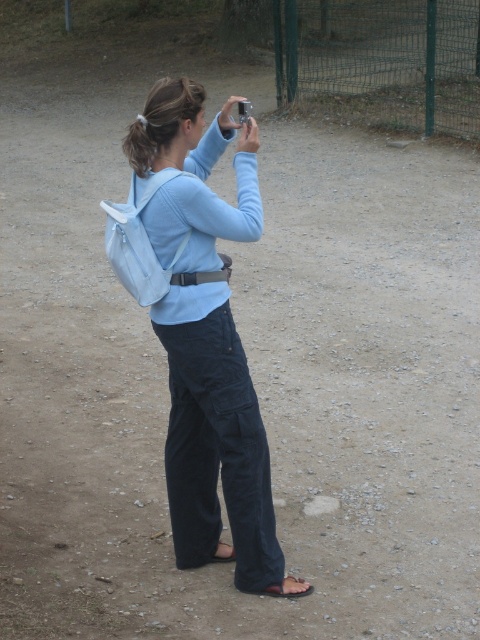
Question: Which object appears closest to the camera in this image?

Choices:
 (A) light blue fabric backpack at center
 (B) green wire mesh fence at upper right

Answer: (A)

Question: Is light blue fabric backpack at center smaller than green wire mesh fence at upper right?

Choices:
 (A) yes
 (B) no

Answer: (B)

Question: Does light blue fabric backpack at center lie in front of green wire mesh fence at upper right?

Choices:
 (A) yes
 (B) no

Answer: (A)

Question: Which object appears farthest from the camera in this image?

Choices:
 (A) green wire mesh fence at upper right
 (B) light blue fabric backpack at center

Answer: (A)

Question: Is light blue fabric backpack at center wider than green wire mesh fence at upper right?

Choices:
 (A) yes
 (B) no

Answer: (A)

Question: Which point appears closest to the camera in this image?

Choices:
 (A) (183, 250)
 (B) (285, 49)

Answer: (A)